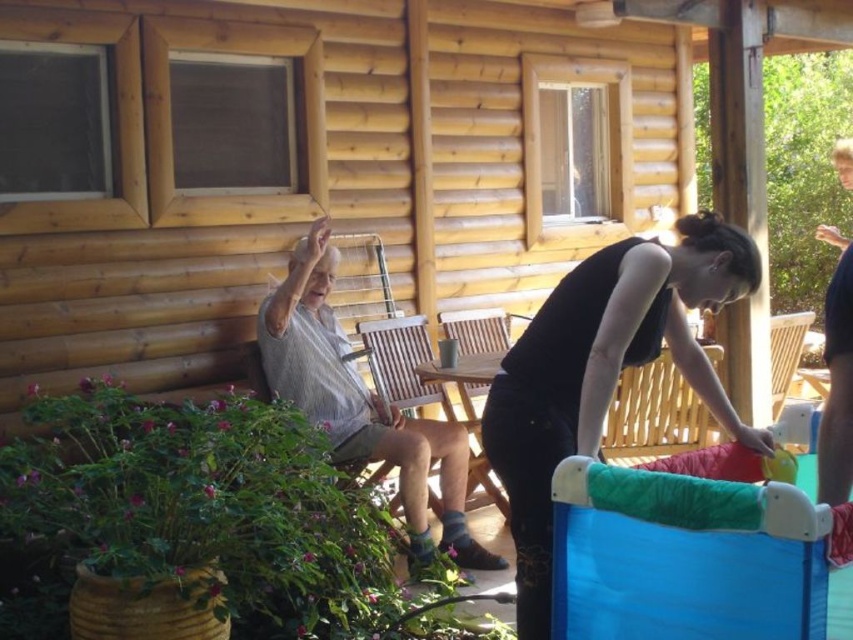
Question: Does black matte tank top at center lie behind light gray striped shirt at left?

Choices:
 (A) yes
 (B) no

Answer: (B)

Question: Which of the following is the farthest from the observer?

Choices:
 (A) light gray striped shirt at left
 (B) black matte tank top at center

Answer: (A)

Question: Is black matte tank top at center bigger than light gray striped shirt at left?

Choices:
 (A) no
 (B) yes

Answer: (A)

Question: Where is black matte tank top at center located in relation to light gray striped shirt at left in the image?

Choices:
 (A) left
 (B) right

Answer: (B)